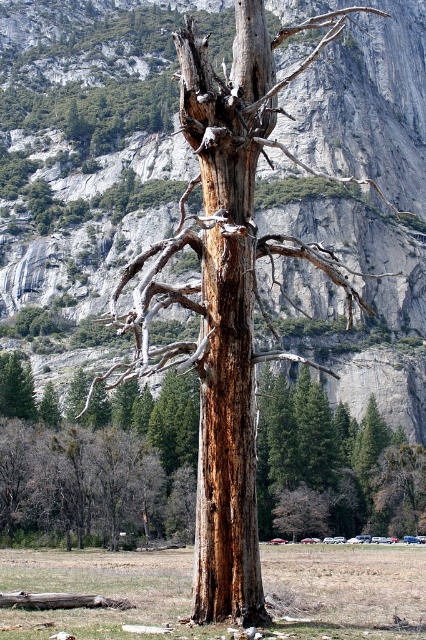
Is rugged stone mountain at center to the right of brown rough bark tree trunk at center from the viewer's perspective?

Indeed, rugged stone mountain at center is positioned on the right side of brown rough bark tree trunk at center.

Does point (321, 92) lie in front of point (236, 58)?

No.

Find the location of a particular element. The width and height of the screenshot is (426, 640). rugged stone mountain at center is located at coordinates (89, 138).

Is point (167, 412) closer to camera compared to point (242, 582)?

No, (167, 412) is further to viewer.

Between point (379, 435) and point (198, 486), which one is positioned behind?

The point (379, 435) is behind.

The width and height of the screenshot is (426, 640). What do you see at coordinates (103, 472) in the screenshot?
I see `rusty wood tree trunk at center` at bounding box center [103, 472].

Locate an element on the screen. This screenshot has width=426, height=640. rusty wood tree trunk at center is located at coordinates click(103, 472).

Who is positioned more to the left, rugged stone mountain at center or rusty wood tree trunk at center?

rusty wood tree trunk at center is more to the left.

Which is in front, point (396, 147) or point (419, 525)?

Positioned in front is point (419, 525).

Who is more forward, (x=23, y=164) or (x=25, y=502)?

Point (x=25, y=502) is more forward.

Locate an element on the screen. rugged stone mountain at center is located at coordinates (x=89, y=138).